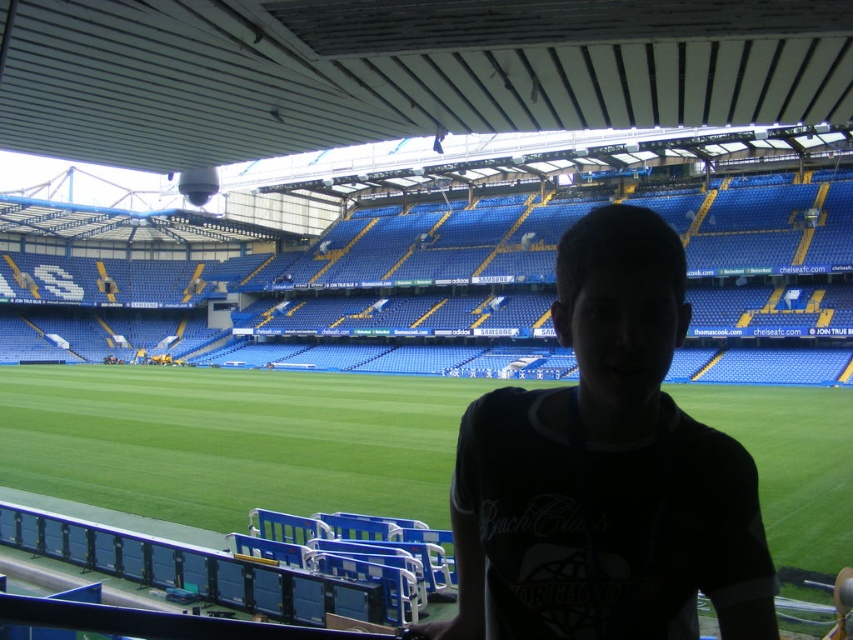
Can you confirm if black matte shirt at center is taller than green grass at center?

Correct, black matte shirt at center is much taller as green grass at center.

Is black matte shirt at center shorter than green grass at center?

No, black matte shirt at center is not shorter than green grass at center.

Between point (631, 253) and point (802, 401), which one is positioned in front?

Point (631, 253)

Locate an element on the screen. This screenshot has height=640, width=853. black matte shirt at center is located at coordinates (606, 470).